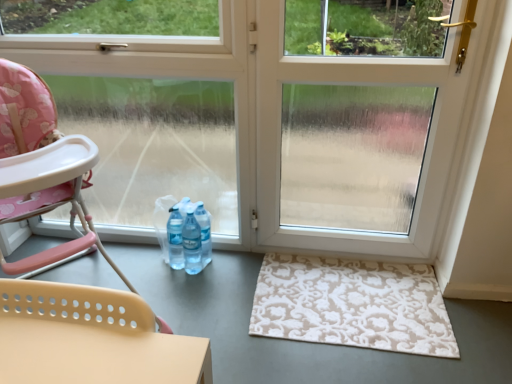
Question: Is clear glass window at left bigger or smaller than transparent plastic screen door at center?

Choices:
 (A) big
 (B) small

Answer: (A)

Question: From their relative heights in the image, would you say clear glass window at left is taller or shorter than transparent plastic screen door at center?

Choices:
 (A) short
 (B) tall

Answer: (B)

Question: Estimate the real-world distances between objects in this image. Which object is farther from the transparent plastic screen door at center?

Choices:
 (A) beige floral rug at lower right
 (B) clear glass window at left
 (C) pink fabric highchair at left

Answer: (C)

Question: Considering the real-world distances, which object is closest to the transparent plastic screen door at center?

Choices:
 (A) beige floral rug at lower right
 (B) clear glass window at left
 (C) pink fabric highchair at left

Answer: (A)